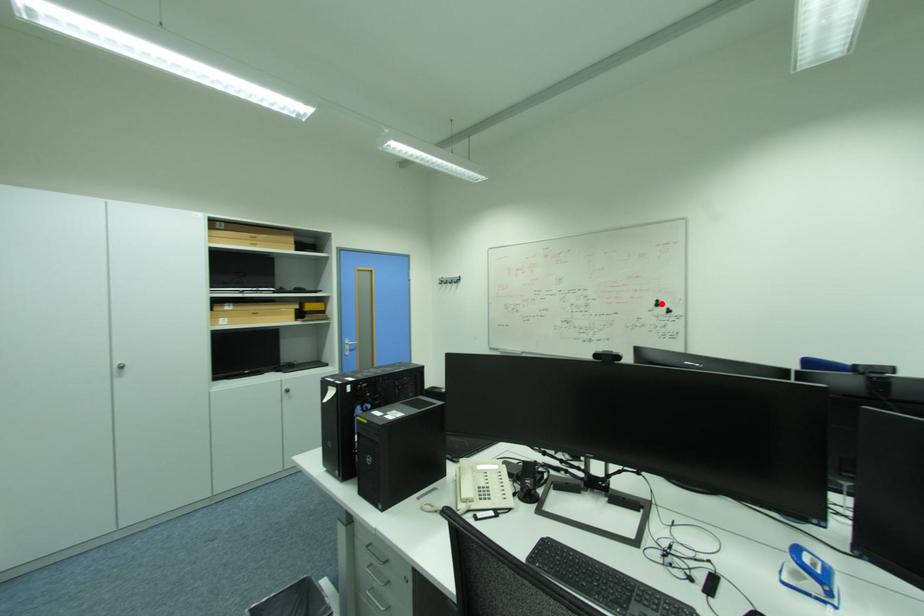
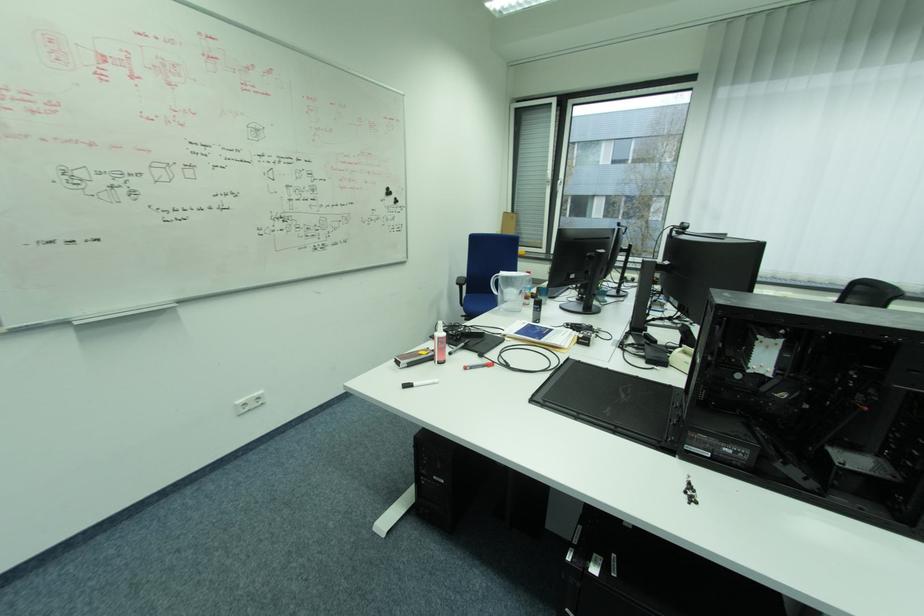
Locate, in the second image, the point that corresponds to the highlighted location in the first image.

(392, 192)